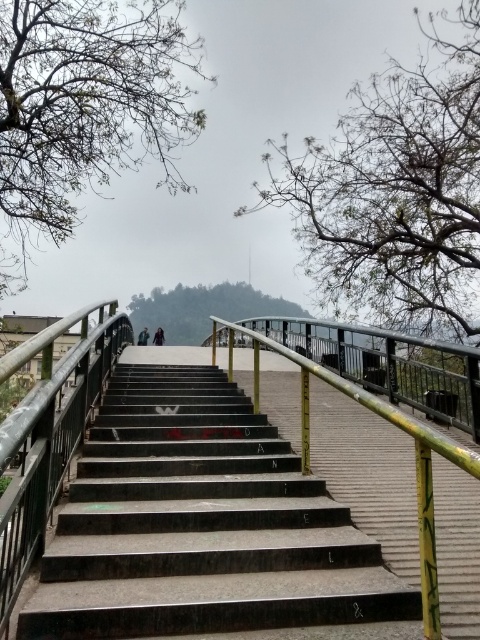
You are a hiker carrying a dark green jacket at center and standing on the black polished stairs at center. Which object takes up more space in the scene?

The black polished stairs at center is bigger than dark green jacket at center, so the black polished stairs at center takes up more space in the scene.

You are standing at the bottom of the staircase and looking up. There is a point marked at coordinates (85, 108) in the image. What object is located at this point?

The point at coordinates (85, 108) indicates bare branches at upper left.

You are standing at the base of the staircase and looking up towards the bridge. There are two points marked on the staircase, one at coordinate point (72, 113) and another at point (143, 342). Which of these points is closer to you?

The point at coordinate point (72, 113) is closer to you than the point at (143, 342).